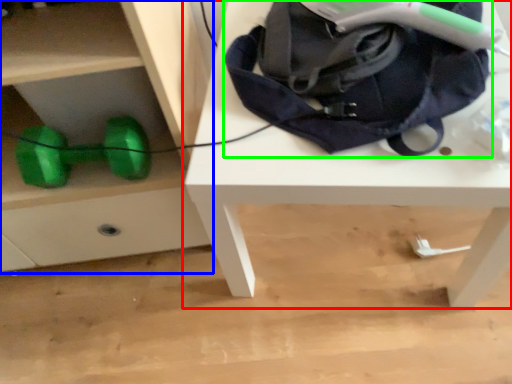
Question: Estimate the real-world distances between objects in this image. Which object is farther from table (highlighted by a red box), chest of drawers (highlighted by a blue box) or bag (highlighted by a green box)?

Choices:
 (A) chest of drawers
 (B) bag

Answer: (A)